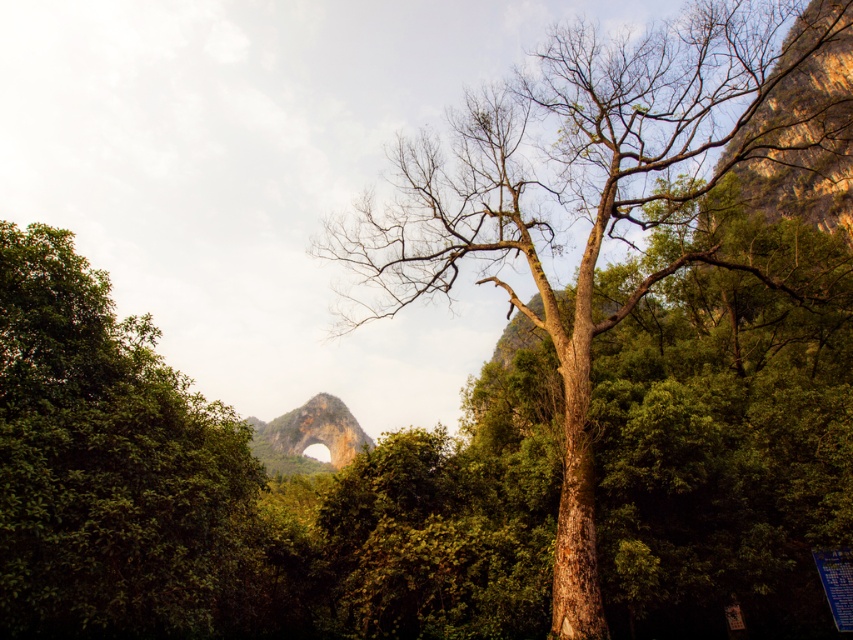
Based on the photo, you are standing at the point marked by the coordinates point (622, 346). What object are you standing on?

You are standing on the brown rough bark tree at center.

You are standing in the forest and want to walk from the green leafy tree at left to the brown rough bark tree at center. Which direction should you move?

You should move to the right because the brown rough bark tree at center is to the right of the green leafy tree at left.